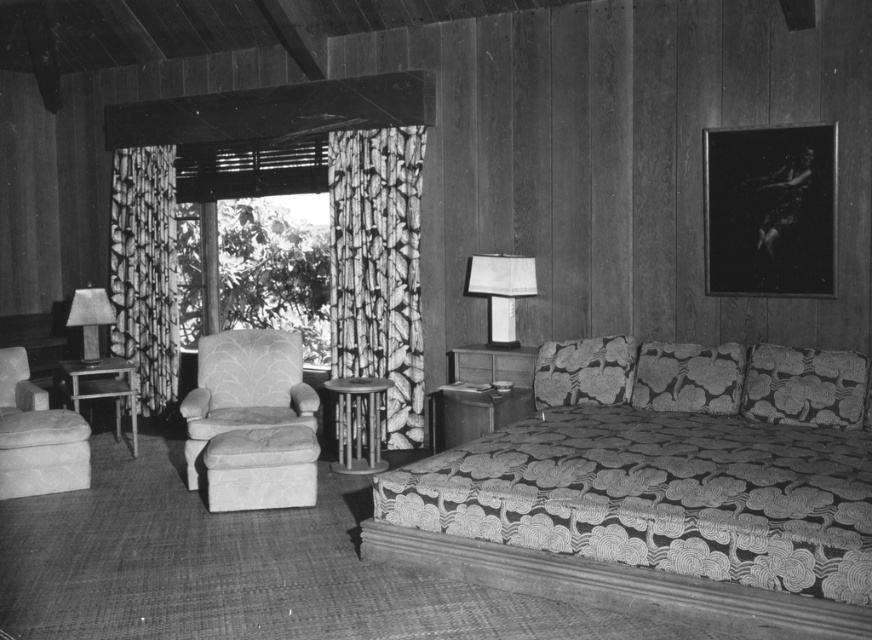
Consider the image. You are standing in the vintage bedroom and want to sit on the patterned fabric couch at center. Where exactly should you aim to sit to reach the point labeled as point (662, 484)?

The point labeled as point (662, 484) is located on the patterned fabric couch at center, so you should aim to sit directly on the couch to reach that point.

You are standing in the vintage bedroom and want to know which of the two points, point (304,460) or point (726,403), is closer to you. Which one is it?

Point (304,460) is closer to the camera than point (726,403), so it is closer to you.